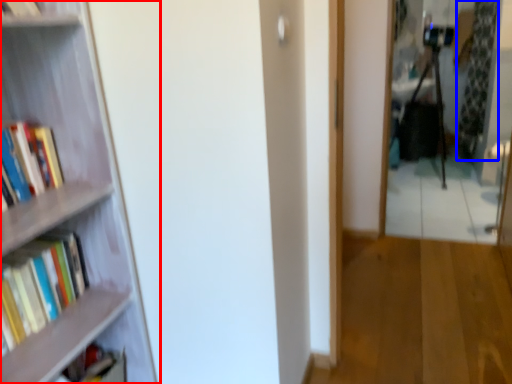
Question: Which of the following is the farthest to the observer, bookcase (highlighted by a red box) or curtain (highlighted by a blue box)?

Choices:
 (A) bookcase
 (B) curtain

Answer: (B)